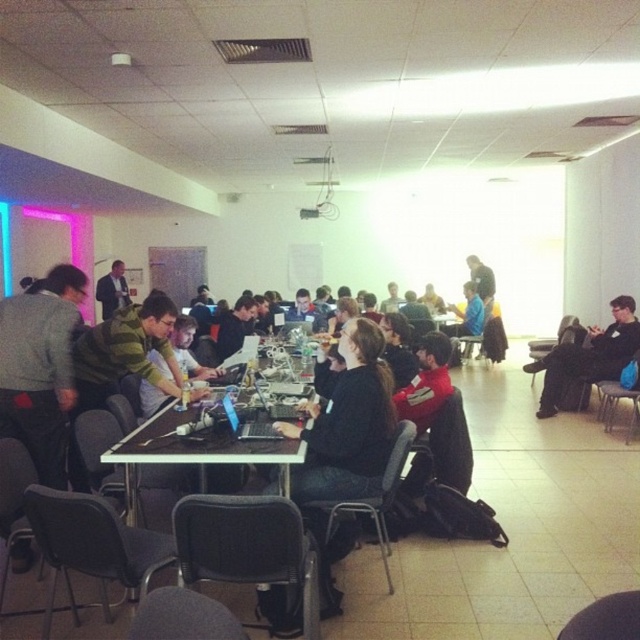
Question: Among these objects, which one is nearest to the camera?

Choices:
 (A) matte black laptop at center
 (B) gray plastic chair at lower left
 (C) black plastic chair at center
 (D) black fabric pants at right

Answer: (B)

Question: Is gray plastic chair at lower left wider than dark gray suit at center?

Choices:
 (A) no
 (B) yes

Answer: (A)

Question: Is gray plastic chair at lower left thinner than dark gray suit at center?

Choices:
 (A) yes
 (B) no

Answer: (A)

Question: Which object is farther from the camera taking this photo?

Choices:
 (A) gray plastic chair at lower right
 (B) gray plastic chair at center

Answer: (A)

Question: Which point is farther from the camera taking this photo?

Choices:
 (A) (22, 524)
 (B) (109, 314)
 (C) (416, 396)
 (D) (157, 541)

Answer: (B)

Question: Is gray plastic chair at lower left further to the viewer compared to gray plastic chair at center?

Choices:
 (A) yes
 (B) no

Answer: (B)